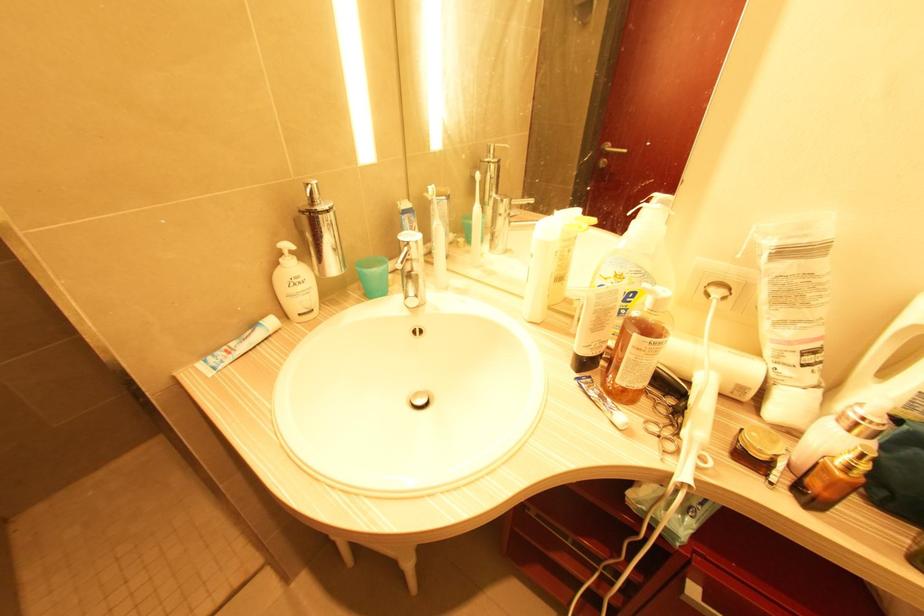
This screenshot has height=616, width=924. What are the coordinates of `gold jar lid` in the screenshot? It's located at (761, 440).